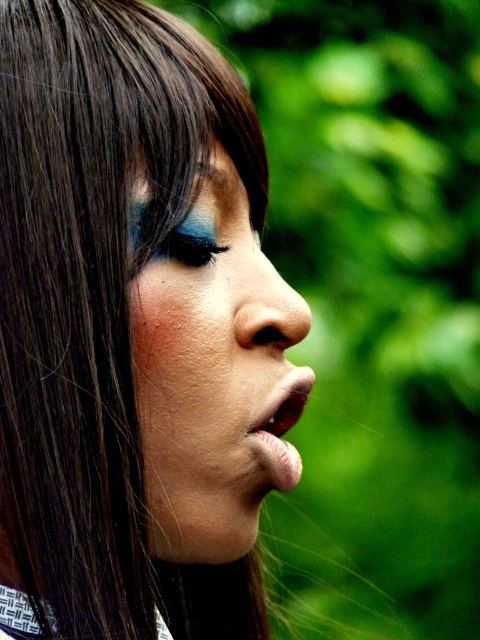
You are a photographer adjusting your camera settings to focus on the matte skin face at center in the image. What are the coordinates where you should aim your focus point?

The coordinates where you should aim your focus point are at point [214,380].

You are a photographer adjusting the focus on your camera. You need to ensure both the matte skin face at center and the brown skin freckle at lower center are in focus. Which object should you focus on first to achieve this?

You should focus on the brown skin freckle at lower center first because it is closer to the camera than the matte skin face at center. By focusing on the closer object, the farther one will also be in focus due to the depth of field.

You are a photographer adjusting your camera settings to focus on the matte skin face at center and the shiny blue eyeshadow at upper center. Which object should you focus on first if you want to ensure both are in focus, given their positions?

The shiny blue eyeshadow at upper center is to the left of the matte skin face at center, so focusing on the matte skin face at center first would help ensure both are in focus as it is positioned further to the right.